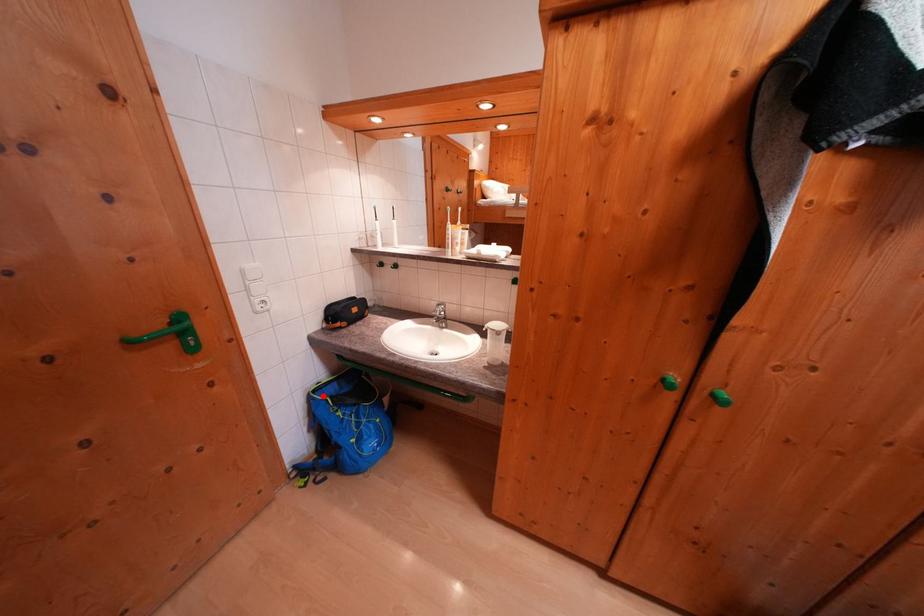
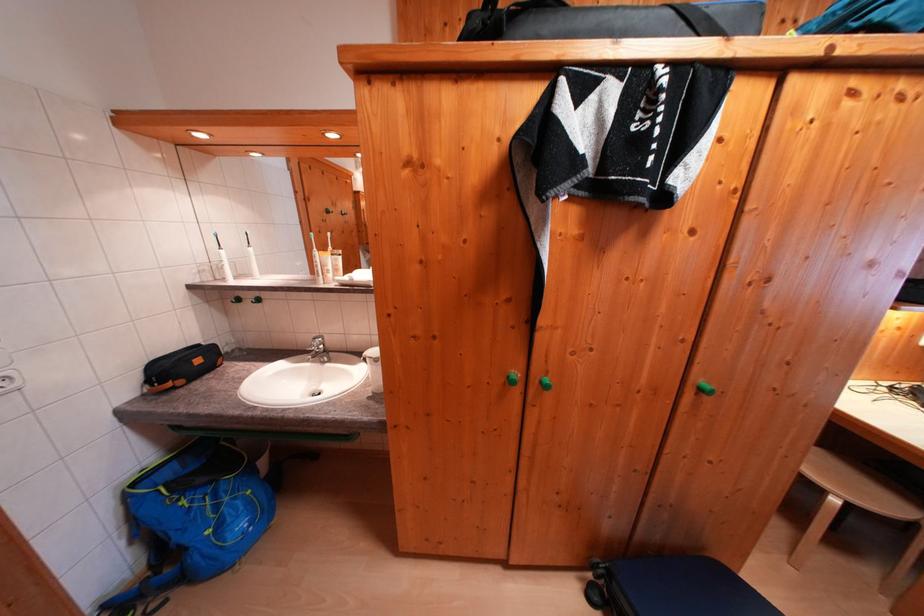
The point at the highlighted location is marked in the first image. Where is the corresponding point in the second image?

(142, 488)